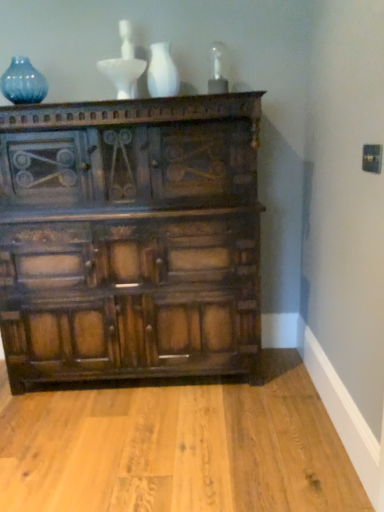
Find the location of a particular element. This screenshot has height=512, width=384. unoccupied area in front of dark wood chest of drawers at center is located at coordinates (142, 443).